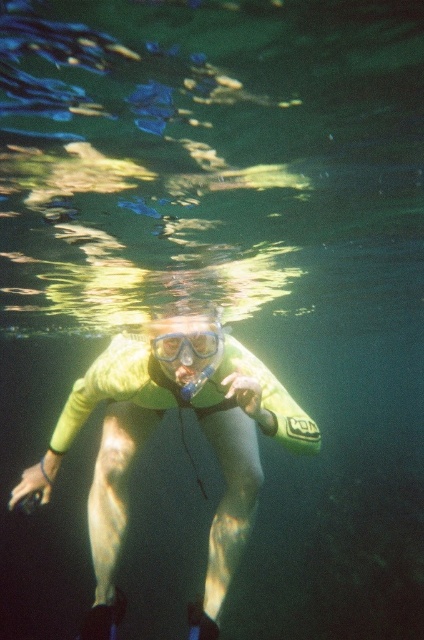
Question: Which point is closer to the camera?

Choices:
 (A) click(x=192, y=337)
 (B) click(x=120, y=486)

Answer: (A)

Question: Where is yellow neoprene wetsuit at center located in relation to clear plastic goggles at center in the image?

Choices:
 (A) right
 (B) left

Answer: (B)

Question: Which point is farther to the camera?

Choices:
 (A) yellow neoprene wetsuit at center
 (B) clear plastic goggles at center

Answer: (B)

Question: Is yellow neoprene wetsuit at center wider than clear plastic goggles at center?

Choices:
 (A) yes
 (B) no

Answer: (A)

Question: Does yellow neoprene wetsuit at center appear under clear plastic goggles at center?

Choices:
 (A) no
 (B) yes

Answer: (B)